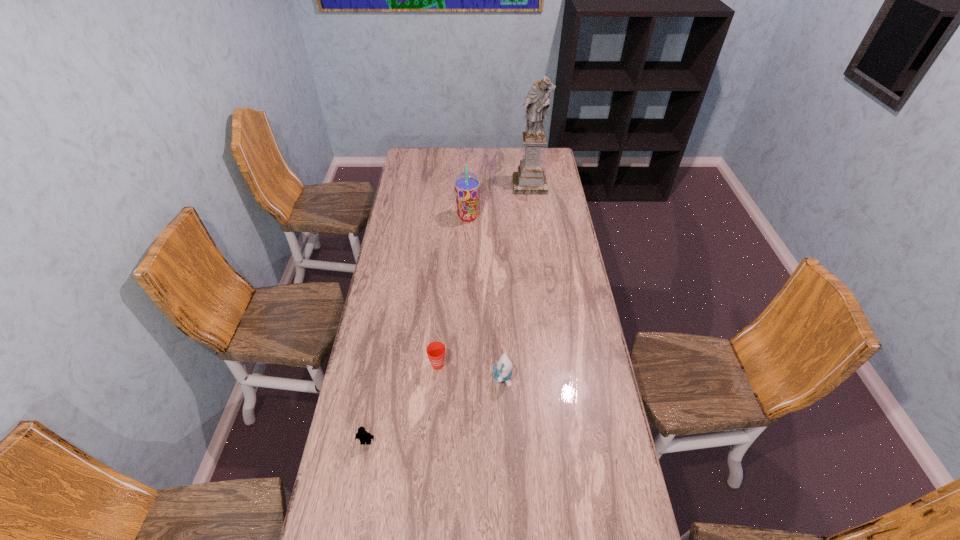
Identify which object is the closest to the kitten. Please provide its 2D coordinates. Your answer should be formatted as a tuple, i.e. [(x, y)], where the tuple contains the x and y coordinates of a point satisfying the conditions above.

[(436, 350)]

At what (x,y) coordinates should I click in order to perform the action: click on free space that satisfies the following two spatial constraints: 1. on the face of the kitten; 2. on the face of the nearest object. Please return your answer as a coordinate pair (x, y). This screenshot has width=960, height=540. Looking at the image, I should click on (505, 442).